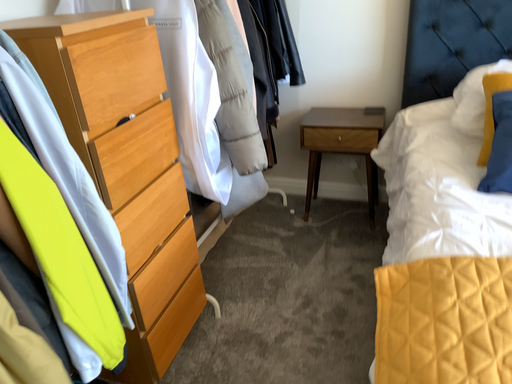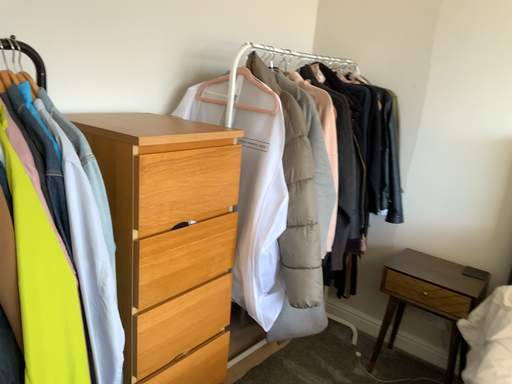
Question: Which way did the camera rotate in the video?

Choices:
 (A) rotated right
 (B) rotated left

Answer: (B)